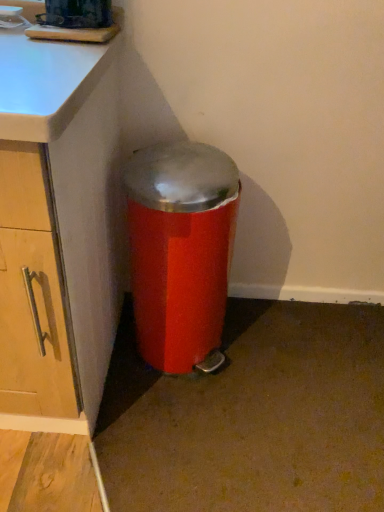
Identify the location of metallic red trash can at lower right. Image resolution: width=384 pixels, height=512 pixels. (180, 250).

Measure the distance between metallic red trash can at lower right and camera.

36.88 inches.

The image size is (384, 512). What do you see at coordinates (180, 250) in the screenshot?
I see `metallic red trash can at lower right` at bounding box center [180, 250].

Identify the location of metallic red trash can at lower right. (180, 250).